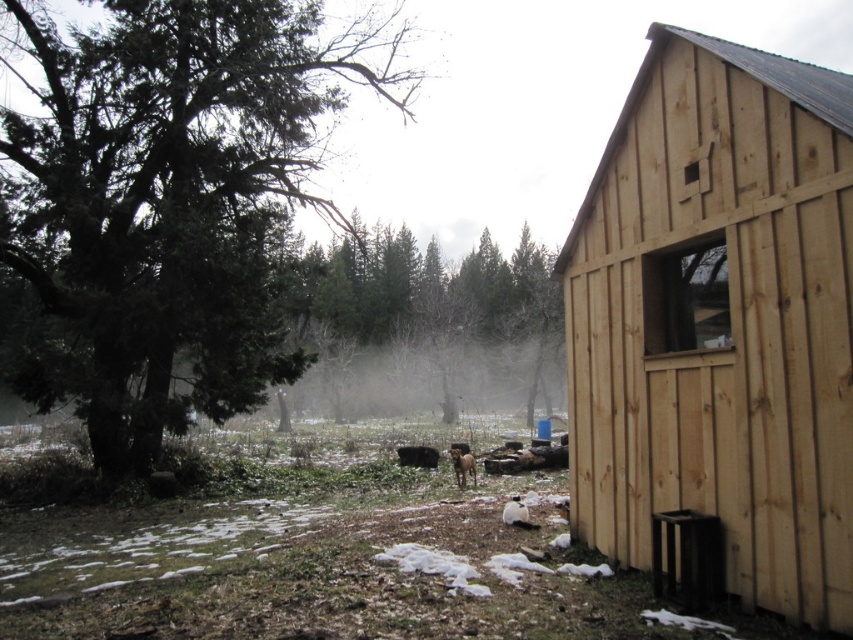
Question: Does natural wood cabin at right have a lesser width compared to green matte tree at center?

Choices:
 (A) yes
 (B) no

Answer: (A)

Question: Is natural wood cabin at right positioned behind green textured tree at left?

Choices:
 (A) no
 (B) yes

Answer: (A)

Question: Which object is positioned closest to the green matte tree at center?

Choices:
 (A) natural wood cabin at right
 (B) green textured tree at left

Answer: (B)

Question: Which object appears farthest from the camera in this image?

Choices:
 (A) green matte tree at center
 (B) green textured tree at left
 (C) natural wood cabin at right

Answer: (A)

Question: Which point is closer to the camera?

Choices:
 (A) green matte tree at center
 (B) natural wood cabin at right

Answer: (B)

Question: Does natural wood cabin at right have a smaller size compared to green matte tree at center?

Choices:
 (A) yes
 (B) no

Answer: (A)